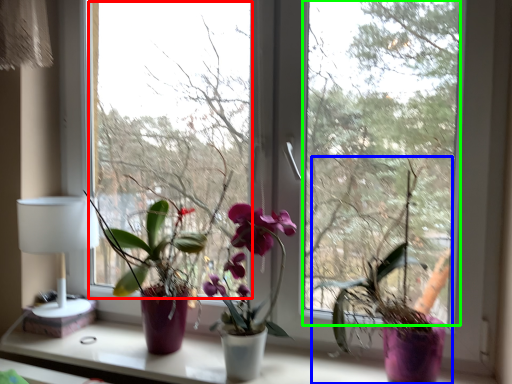
Question: Which object is positioned closest to window screen (highlighted by a red box)? Select from houseplant (highlighted by a blue box) and window screen (highlighted by a green box).

Choices:
 (A) houseplant
 (B) window screen

Answer: (B)